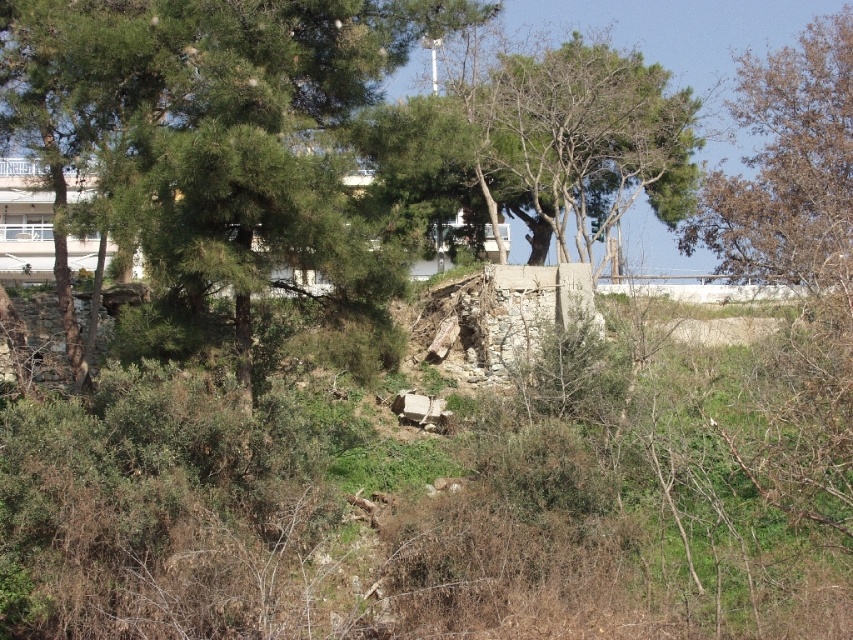
Question: Does green leafy tree at center have a smaller size compared to brown leafy tree at upper right?

Choices:
 (A) yes
 (B) no

Answer: (A)

Question: Does green leafy tree at center lie in front of brown leafy tree at upper right?

Choices:
 (A) no
 (B) yes

Answer: (B)

Question: Is green leafy tree at center thinner than brown leafy tree at upper right?

Choices:
 (A) yes
 (B) no

Answer: (A)

Question: Among these points, which one is farthest from the camera?

Choices:
 (A) tap(113, 124)
 (B) tap(811, 104)

Answer: (B)